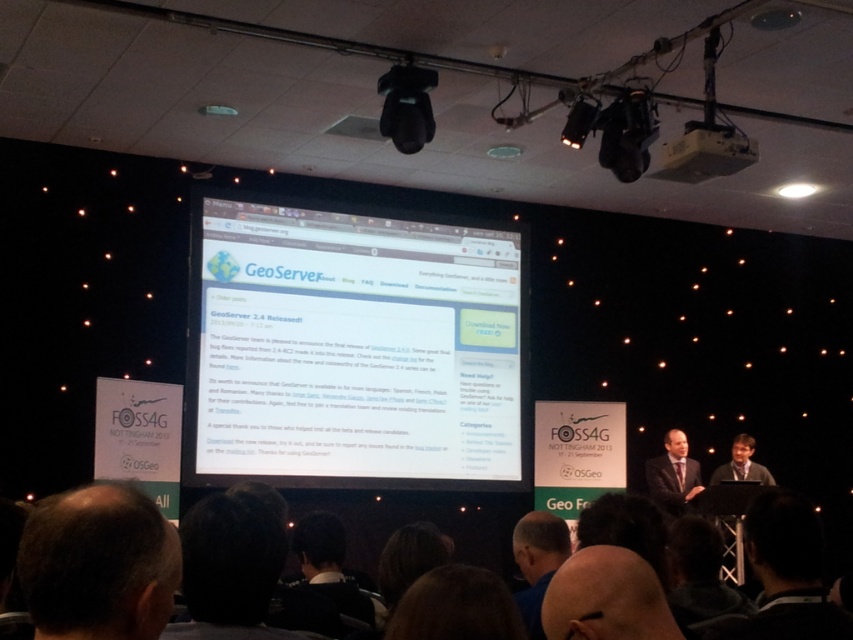
You are standing at the back of the conference hall and want to check if the white plastic projector at upper center can project clearly onto the screen without the blue shirt at lower center blocking the light. The projector requires a clear line of sight within 3 meters to function properly. Can the projector project clearly?

The white plastic projector at upper center is 2.98 meters away from the blue shirt at lower center. Since the required distance for clear projection is within 3 meters, the projector can project clearly as the distance is just under the required threshold.

You are an attendee at the conference and want to take a photo of the presentation screen. The white plastic projector at upper center and the blue shirt at lower center are in your camera frame. Which object will appear larger in your photo?

The white plastic projector at upper center will appear larger in the photo because it is much taller than the blue shirt at lower center.